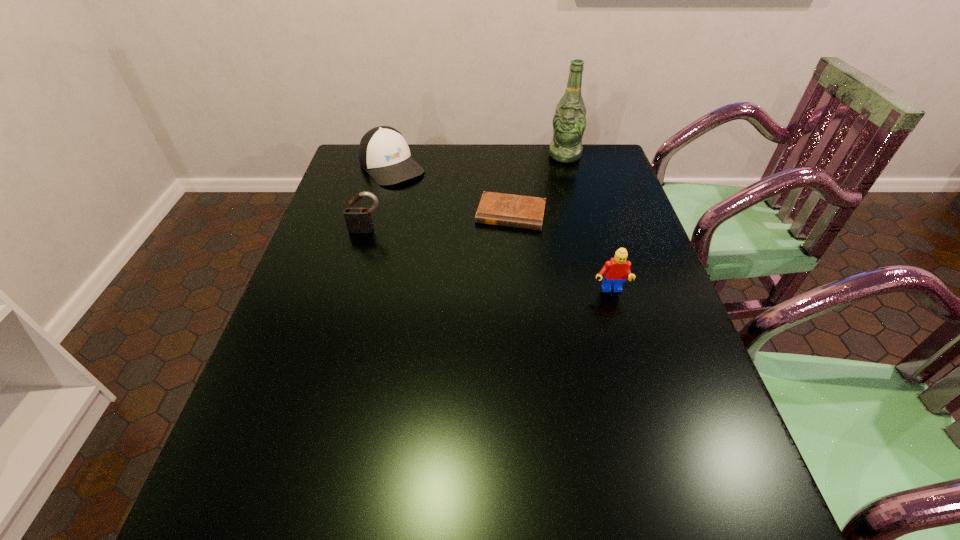
Where is `vacant space located on the surface of the beer bottle`? vacant space located on the surface of the beer bottle is located at coordinates (547, 190).

Where is `free location located 0.360m on the front panel of the cap`? This screenshot has width=960, height=540. free location located 0.360m on the front panel of the cap is located at coordinates (468, 245).

Locate an element on the screen. free space located 0.390m on the front panel of the cap is located at coordinates (474, 251).

Identify the location of vacant region located on the front panel of the cap. (476, 253).

Image resolution: width=960 pixels, height=540 pixels. In order to click on vacant space positioned 0.290m on the spine side of the diary in this screenshot , I will do `click(487, 306)`.

I want to click on free space located on the spine side of the diary, so click(501, 247).

The image size is (960, 540). What are the coordinates of `vacant area situated 0.050m on the spine side of the diary` in the screenshot? It's located at (502, 242).

The image size is (960, 540). I want to click on beer bottle present at the far edge, so click(569, 122).

Where is `cap present at the far edge`? cap present at the far edge is located at coordinates (384, 154).

Locate an element on the screen. padlock located at the left edge is located at coordinates (357, 218).